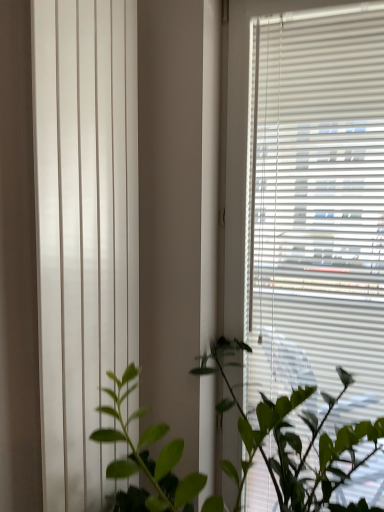
Describe the element at coordinates (293, 440) in the screenshot. The width and height of the screenshot is (384, 512). I see `green leafy plant at center` at that location.

Describe the element at coordinates (84, 233) in the screenshot. I see `white smooth vertical blinds at left` at that location.

Where is `green leafy plant at center`? green leafy plant at center is located at coordinates (293, 440).

Considering the relative sizes of white matte blinds at right and white smooth vertical blinds at left in the image provided, is white matte blinds at right taller than white smooth vertical blinds at left?

Yes.

Considering the positions of objects white matte blinds at right and white smooth vertical blinds at left in the image provided, who is more to the left, white matte blinds at right or white smooth vertical blinds at left?

white smooth vertical blinds at left is more to the left.

Which point is more forward, [261,271] or [47,444]?

Positioned in front is point [47,444].

Which object is thinner, white matte blinds at right or white smooth vertical blinds at left?

white smooth vertical blinds at left is thinner.

Considering the positions of objects white matte blinds at right and green leafy plant at center in the image provided, who is more to the left, white matte blinds at right or green leafy plant at center?

Positioned to the left is green leafy plant at center.

Could you tell me if white matte blinds at right is turned towards green leafy plant at center?

Yes, white matte blinds at right is oriented towards green leafy plant at center.

From the image's perspective, is white matte blinds at right above green leafy plant at center?

Yes, from the image's perspective, white matte blinds at right is over green leafy plant at center.

Who is bigger, white smooth vertical blinds at left or white matte blinds at right?

With larger size is white matte blinds at right.

Consider the image. Is there a large distance between white smooth vertical blinds at left and white matte blinds at right?

No, white smooth vertical blinds at left is not far away from white matte blinds at right.

From the image's perspective, would you say white smooth vertical blinds at left is positioned over white matte blinds at right?

Yes, from the image's perspective, white smooth vertical blinds at left is over white matte blinds at right.

Is white smooth vertical blinds at left in front of green leafy plant at center?

No, white smooth vertical blinds at left is further to the viewer.

Who is bigger, white smooth vertical blinds at left or green leafy plant at center?

green leafy plant at center.

Based on the photo, is white smooth vertical blinds at left surrounding green leafy plant at center?

That's incorrect, green leafy plant at center is not inside white smooth vertical blinds at left.

From the image's perspective, is white smooth vertical blinds at left under green leafy plant at center?

Incorrect, from the image's perspective, white smooth vertical blinds at left is higher than green leafy plant at center.

Is green leafy plant at center turned away from white matte blinds at right?

Correct, green leafy plant at center is looking away from white matte blinds at right.

From a real-world perspective, which is physically above, green leafy plant at center or white matte blinds at right?

white matte blinds at right is physically above.

Looking at this image, from the image's perspective, is green leafy plant at center positioned above or below white matte blinds at right?

From the image's perspective, green leafy plant at center appears below white matte blinds at right.

Between point (114, 434) and point (281, 294), which one is positioned in front?

The point (114, 434) is closer to the camera.

From a real-world perspective, is green leafy plant at center physically above white smooth vertical blinds at left?

Incorrect, from a real-world perspective, green leafy plant at center is lower than white smooth vertical blinds at left.

Considering the sizes of green leafy plant at center and white smooth vertical blinds at left in the image, is green leafy plant at center wider or thinner than white smooth vertical blinds at left?

green leafy plant at center is wider than white smooth vertical blinds at left.

Considering the points (299, 394) and (61, 433), which point is in front, point (299, 394) or point (61, 433)?

Point (61, 433)

At what (x,y) coordinates should I click in order to perform the action: click on shutter located above the green leafy plant at center (from a real-world perspective). Please return your answer as a coordinate pair (x, y). Looking at the image, I should click on (84, 233).

Identify the location of shutter located on the left of white matte blinds at right. (84, 233).

Locate an element on the screen. The height and width of the screenshot is (512, 384). window blind that appears on the right of green leafy plant at center is located at coordinates (317, 208).

When comparing their distances from white smooth vertical blinds at left, does green leafy plant at center or white matte blinds at right seem closer?

green leafy plant at center is closer to white smooth vertical blinds at left.

From the picture: Looking at the image, which one is located closer to white matte blinds at right, white smooth vertical blinds at left or green leafy plant at center?

green leafy plant at center.

From the image, which object appears to be nearer to white smooth vertical blinds at left, white matte blinds at right or green leafy plant at center?

Based on the image, green leafy plant at center appears to be nearer to white smooth vertical blinds at left.

Based on their spatial positions, is white matte blinds at right or white smooth vertical blinds at left further from green leafy plant at center?

white smooth vertical blinds at left lies further to green leafy plant at center than the other object.

Based on their spatial positions, is white smooth vertical blinds at left or white matte blinds at right further from green leafy plant at center?

Based on the image, white smooth vertical blinds at left appears to be further to green leafy plant at center.

Based on their spatial positions, is green leafy plant at center or white smooth vertical blinds at left further from white matte blinds at right?

white smooth vertical blinds at left lies further to white matte blinds at right than the other object.

Find the location of a particular element. This screenshot has width=384, height=512. shutter between green leafy plant at center and white matte blinds at right from front to back is located at coordinates click(84, 233).